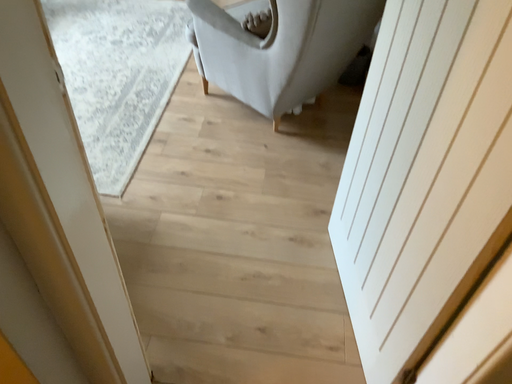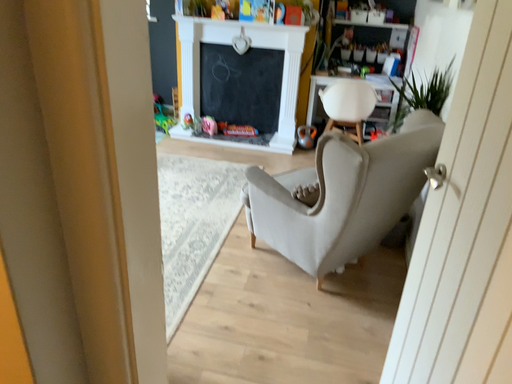
Question: How did the camera likely rotate when shooting the video?

Choices:
 (A) rotated upward
 (B) rotated downward

Answer: (A)